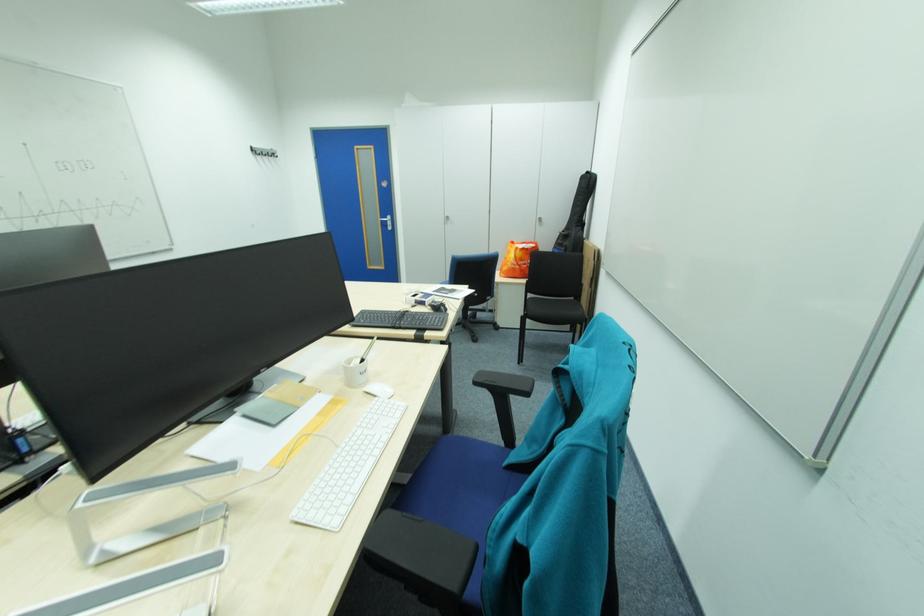
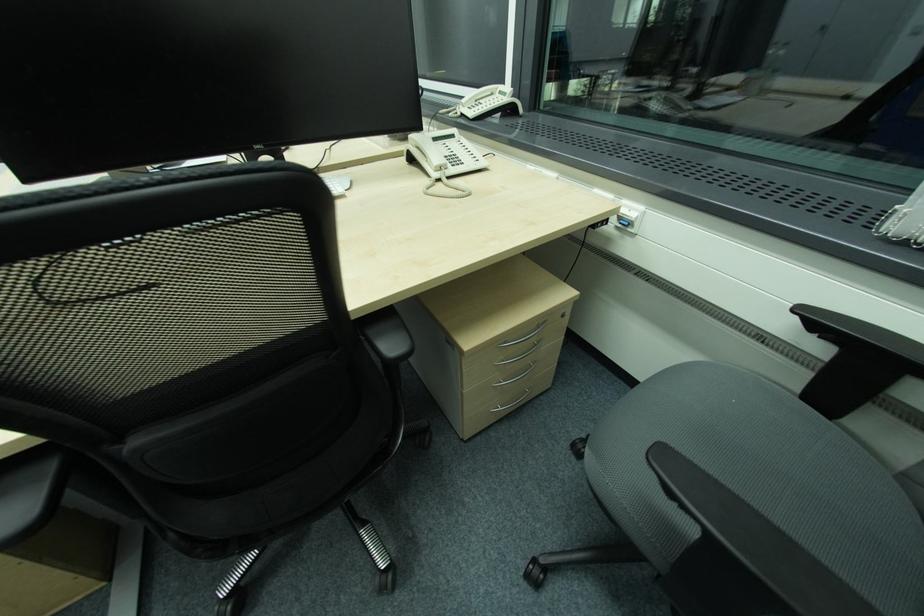
Question: I am providing you with two images of the same scene from different viewpoints. After the viewpoint changes to image2, which objects are now occluded?

Choices:
 (A) drawer handle
 (B) white computer mouse
 (C) red bench sitting surface
 (D) white and silver pen

Answer: (D)